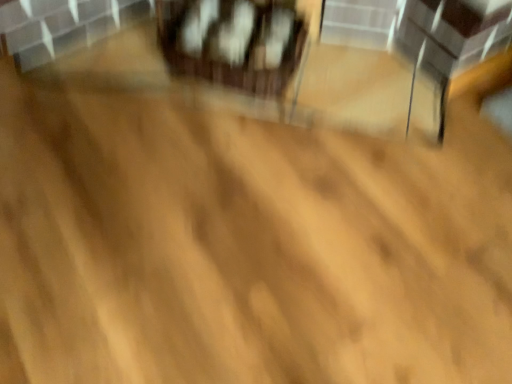
Locate an element on the screen. The width and height of the screenshot is (512, 384). wooden armchair at center is located at coordinates (234, 43).

This screenshot has height=384, width=512. Describe the element at coordinates (234, 43) in the screenshot. I see `wooden armchair at center` at that location.

Find the location of a particular element. The image size is (512, 384). wooden armchair at center is located at coordinates (234, 43).